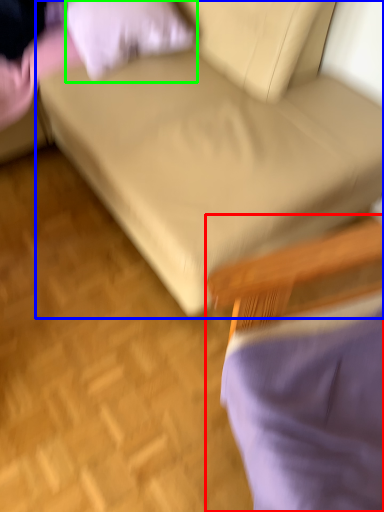
Question: Based on their relative distances, which object is farther from chair (highlighted by a red box)? Choose from studio couch (highlighted by a blue box) and pillow (highlighted by a green box).

Choices:
 (A) studio couch
 (B) pillow

Answer: (B)